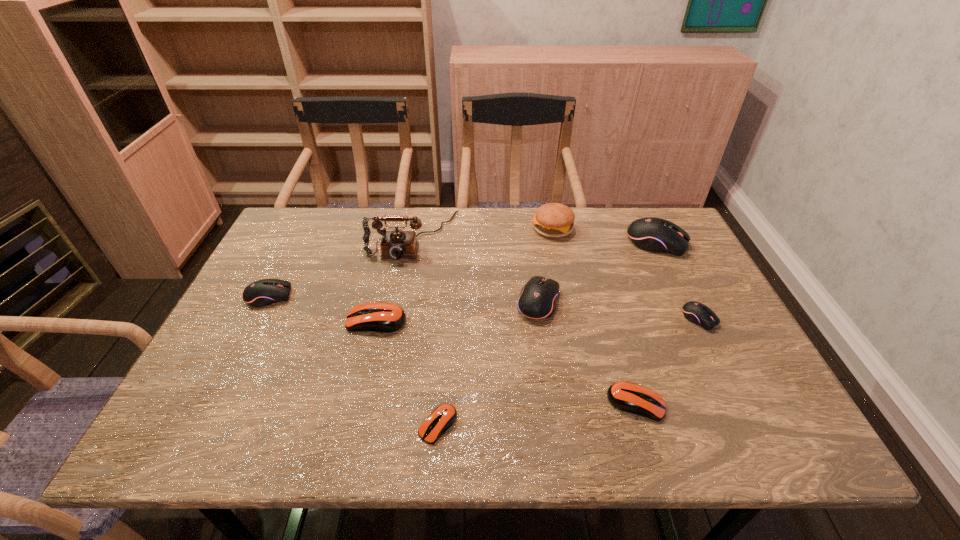
Locate which black computer mouse is the closest to the tallest object. Please provide its 2D coordinates. Your answer should be formatted as a tuple, i.e. [(x, y)], where the tuple contains the x and y coordinates of a point satisfying the conditions above.

[(261, 293)]

Identify which orange computer mouse is located as the second nearest to the tallest computer mouse. Please provide its 2D coordinates. Your answer should be formatted as a tuple, i.e. [(x, y)], where the tuple contains the x and y coordinates of a point satisfying the conditions above.

[(374, 317)]

The height and width of the screenshot is (540, 960). What are the coordinates of `the second closest orange computer mouse relative to the second biggest orange computer mouse` in the screenshot? It's located at (374, 317).

Find the location of a particular element. blank space that satisfies the following two spatial constraints: 1. on the front side of the third computer mouse from right to left; 2. on the left side of the hamburger is located at coordinates (588, 403).

At what (x,y) coordinates should I click in order to perform the action: click on vacant space that satisfies the following two spatial constraints: 1. on the back side of the biggest black computer mouse; 2. on the right side of the smallest orange computer mouse. Please return your answer as a coordinate pair (x, y). The height and width of the screenshot is (540, 960). Looking at the image, I should click on (452, 243).